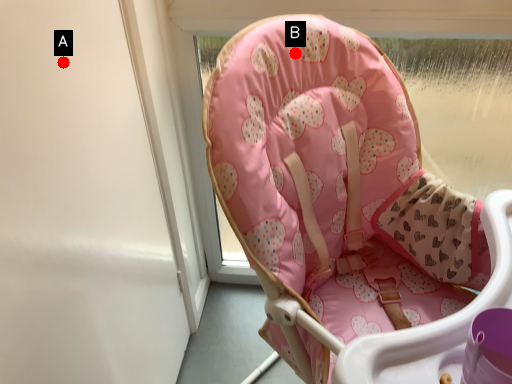
Question: Two points are circled on the image, labeled by A and B beside each circle. Which point appears closest to the camera in this image?

Choices:
 (A) A is closer
 (B) B is closer

Answer: (A)